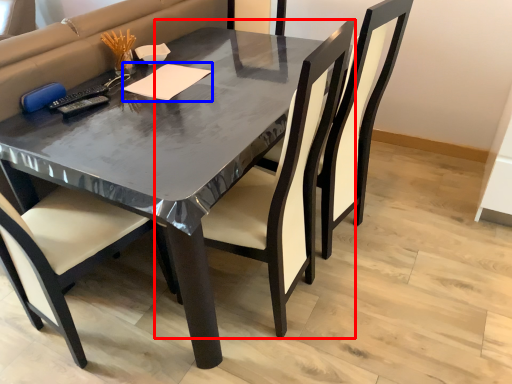
Question: Which object is further to the camera taking this photo, chair (highlighted by a red box) or notepad (highlighted by a blue box)?

Choices:
 (A) chair
 (B) notepad

Answer: (B)